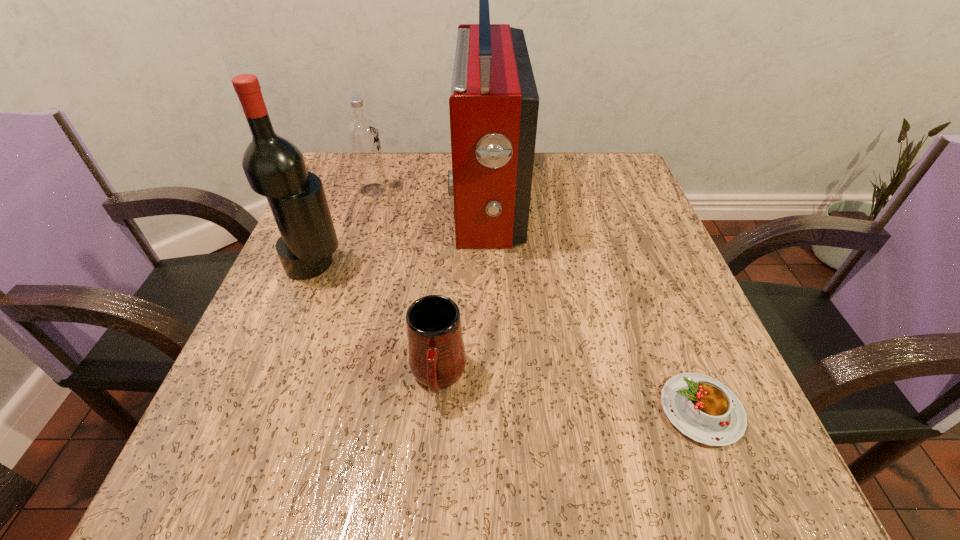
Image resolution: width=960 pixels, height=540 pixels. What are the coordinates of `object that is at the near right corner` in the screenshot? It's located at (702, 408).

The width and height of the screenshot is (960, 540). In the image, there is a desktop. In order to click on vacant space at the far edge in this screenshot , I will do `click(438, 204)`.

In the image, there is a desktop. Where is `vacant space at the near edge`? This screenshot has width=960, height=540. vacant space at the near edge is located at coordinates (582, 455).

Where is `vacant space at the left edge`? vacant space at the left edge is located at coordinates (204, 434).

In the image, there is a desktop. Where is `vacant space at the right edge`? This screenshot has width=960, height=540. vacant space at the right edge is located at coordinates (658, 251).

In the image, there is a desktop. Where is `free region at the far left corner`? Image resolution: width=960 pixels, height=540 pixels. free region at the far left corner is located at coordinates (349, 203).

You are a GUI agent. You are given a task and a screenshot of the screen. Output one action in this format:
    pyautogui.click(x=<x>, y=<y>)
    Task: Click on the free space between the wine bottle and the pudding
    The height and width of the screenshot is (540, 960).
    Given the screenshot: What is the action you would take?
    pyautogui.click(x=508, y=338)

At what (x,y) coordinates should I click in order to perform the action: click on free spot between the radio receiver and the mug. Please return your answer as a coordinate pair (x, y). Looking at the image, I should click on (463, 286).

At what (x,y) coordinates should I click in order to perform the action: click on free space between the pudding and the radio receiver. Please return your answer as a coordinate pair (x, y). The width and height of the screenshot is (960, 540). Looking at the image, I should click on (594, 303).

Identify the location of free area in between the pudding and the third tallest object. (538, 300).